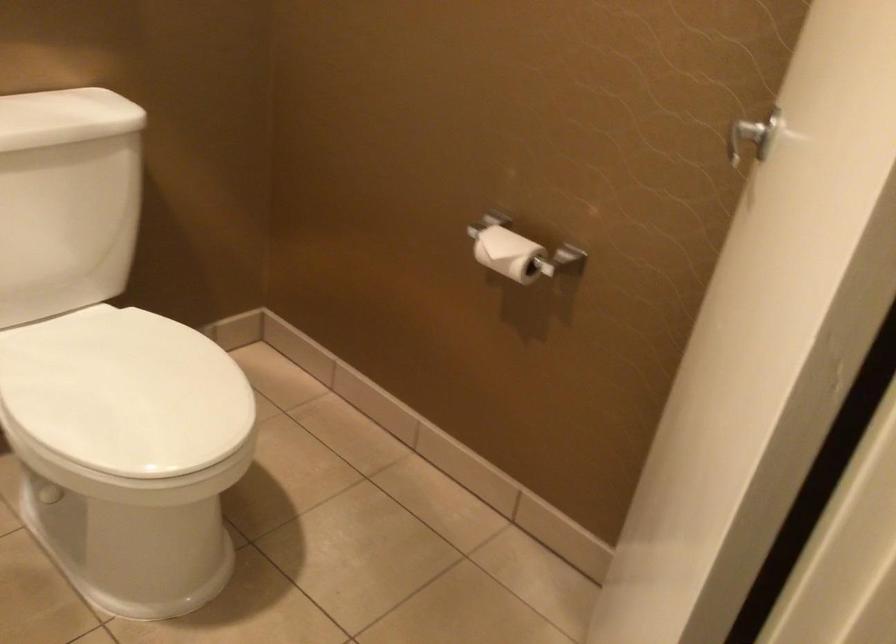
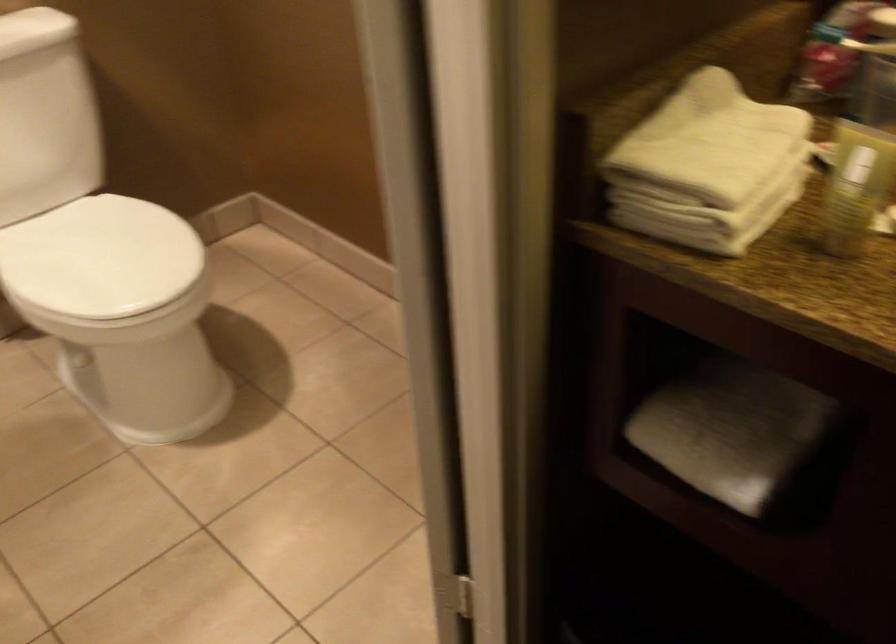
Where in the second image is the point corresponding to (131,392) from the first image?

(99, 257)